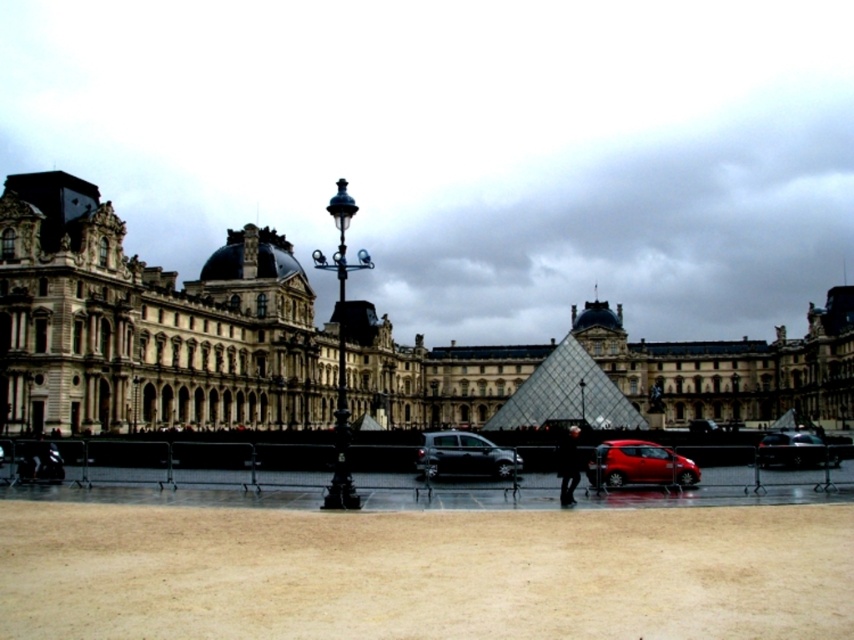
Question: Which point is closer to the camera taking this photo?

Choices:
 (A) (757, 449)
 (B) (598, 465)
 (C) (571, 476)
 (D) (483, 390)

Answer: (C)

Question: Can you confirm if stone building at center is thinner than shiny black car at center?

Choices:
 (A) no
 (B) yes

Answer: (A)

Question: Which point appears closest to the camera in this image?

Choices:
 (A) (486, 468)
 (B) (594, 460)
 (C) (62, 272)

Answer: (B)

Question: In this image, where is shiny red car at center located relative to shiny black car at right?

Choices:
 (A) right
 (B) left

Answer: (B)

Question: Is shiny red car at center behind dark fabric jacket at center?

Choices:
 (A) yes
 (B) no

Answer: (A)

Question: Which of the following is the closest to the observer?

Choices:
 (A) (636, 456)
 (B) (796, 461)
 (C) (86, 220)

Answer: (A)